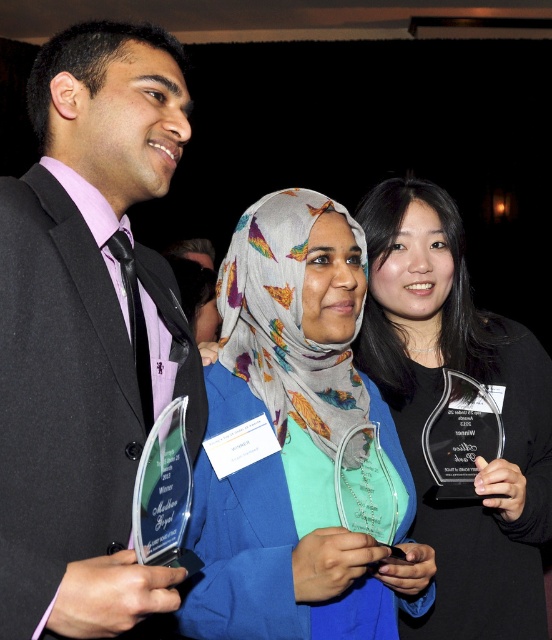
Between matte black suit at left and clear glass award at center, which one appears on the right side from the viewer's perspective?

clear glass award at center is more to the right.

Find the location of a particular element. The width and height of the screenshot is (552, 640). matte black suit at left is located at coordinates (88, 332).

Describe the element at coordinates (88, 332) in the screenshot. The height and width of the screenshot is (640, 552). I see `matte black suit at left` at that location.

This screenshot has height=640, width=552. In order to click on matte black suit at left in this screenshot , I will do `click(88, 332)`.

Between matte black suit at left and translucent glass award at center, which one is positioned higher?

matte black suit at left is higher up.

Is point (77, 170) closer to viewer compared to point (349, 461)?

Yes.

I want to click on matte black suit at left, so click(88, 332).

Does point (192, 532) come behind point (420, 268)?

That is False.

You are a GUI agent. You are given a task and a screenshot of the screen. Output one action in this format:
    pyautogui.click(x=<x>, y=<y>)
    Task: Click on the translucent glass award at center
    
    Given the screenshot: What is the action you would take?
    290,451

Find the location of a particular element. translucent glass award at center is located at coordinates (290, 451).